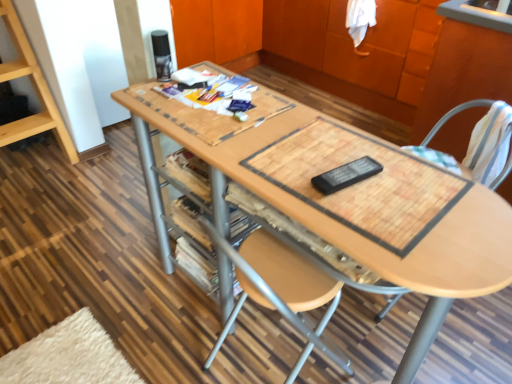
Identify the location of free region under bamboo placemat at center (from a real-world perspective). The height and width of the screenshot is (384, 512). (358, 177).